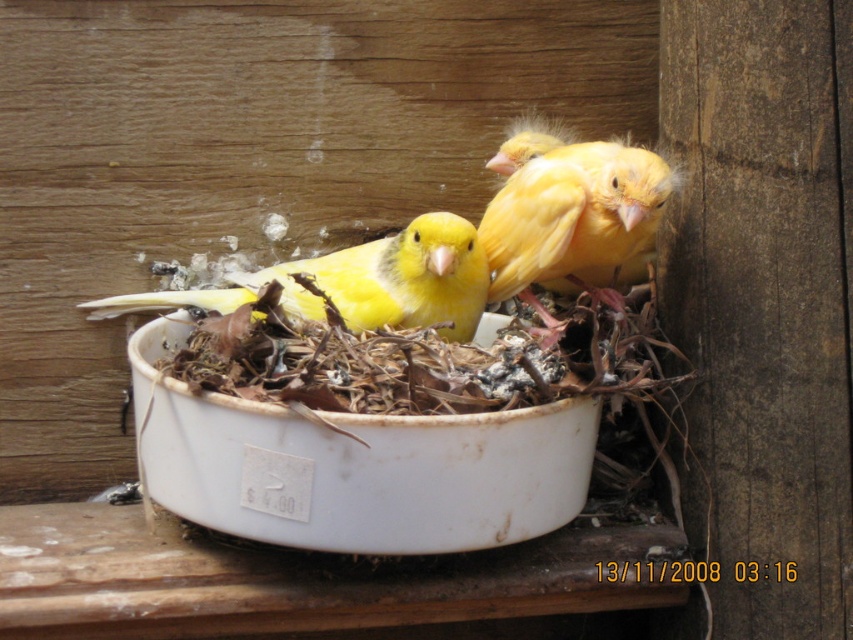
Question: Can you confirm if yellow matte bird at center is smaller than matte yellow canary at center?

Choices:
 (A) yes
 (B) no

Answer: (A)

Question: Which object appears closest to the camera in this image?

Choices:
 (A) matte yellow canary at center
 (B) yellow matte bird at center

Answer: (A)

Question: Does yellow matte bird at center appear over matte yellow canary at center?

Choices:
 (A) no
 (B) yes

Answer: (B)

Question: In this image, where is yellow matte bird at center located relative to matte yellow canary at center?

Choices:
 (A) right
 (B) left

Answer: (A)